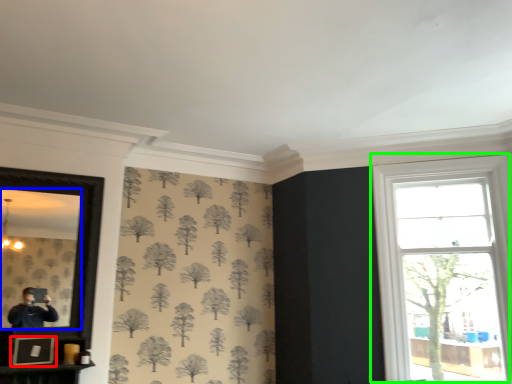
Question: Considering the real-world distances, which object is farthest from picture frame (highlighted by a red box)? mirror (highlighted by a blue box) or window (highlighted by a green box)?

Choices:
 (A) mirror
 (B) window

Answer: (B)